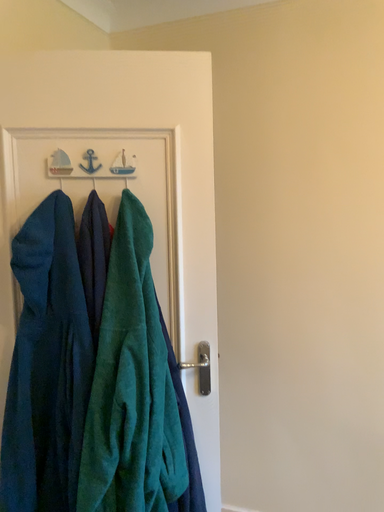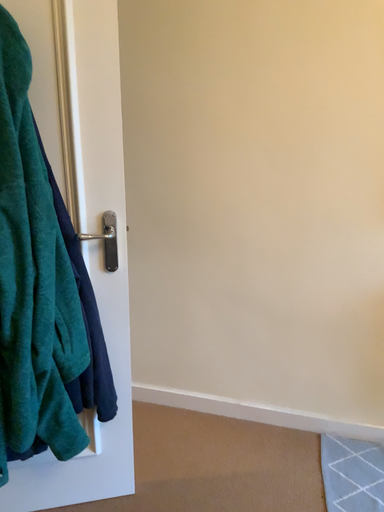
Question: How did the camera likely rotate when shooting the video?

Choices:
 (A) rotated downward
 (B) rotated upward

Answer: (A)